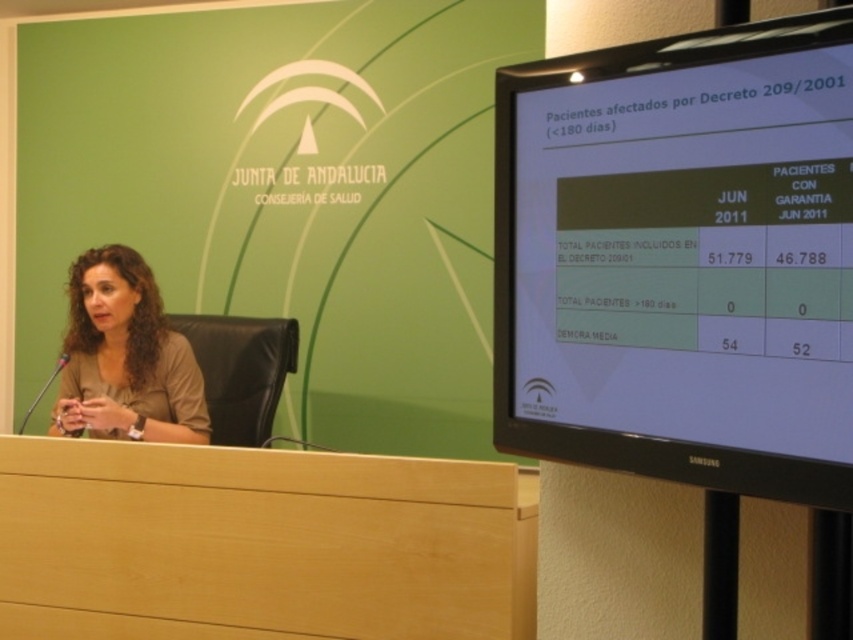
You are an event organizer who needs to adjust the seating arrangement. The speaker wants to face the black glossy monitor at upper right while addressing the audience. Currently, the metallic silver microphone at left is blocking the view. Can you move the microphone to allow the speaker to face the monitor?

The black glossy monitor at upper right is positioned on the right side of the metallic silver microphone at left. To allow the speaker to face the monitor, you can move the microphone to the left side of the podium, creating a clear line of sight between the speaker and the monitor.

You are a photographer standing at the camera position. You need to place a small decorative item on the light wood table at lower left so that it is visible in the photo. Considering the table is 1.72 meters away from the camera, will the item be clearly visible in the photo?

The light wood table at lower left is 1.72 meters from the camera, so the item placed there should be clearly visible in the photo as it is within a typical camera focus range.

You are attending a press conference and notice two points marked on the large screen behind the speaker. Which point, point (599,104) or point (20,422), is closer to you?

Point (599,104) is closer to the viewer than point (20,422).